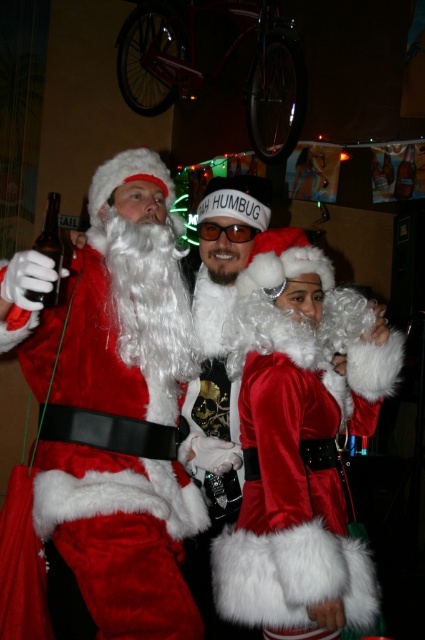
Question: Does velvet santa claus at left appear over velvet santa suit at center?

Choices:
 (A) no
 (B) yes

Answer: (B)

Question: Is velvet santa claus at left wider than velvet santa suit at center?

Choices:
 (A) no
 (B) yes

Answer: (B)

Question: Among these points, which one is farthest from the camera?

Choices:
 (A) (116, 202)
 (B) (206, 582)

Answer: (B)

Question: Can you confirm if velvet santa claus at left is positioned above brown glass bottle at left?

Choices:
 (A) yes
 (B) no

Answer: (B)

Question: Which object is closer to the camera taking this photo?

Choices:
 (A) velvet santa claus at left
 (B) velvet santa suit at center

Answer: (A)

Question: Which of these objects is positioned closest to the velvet santa claus at left?

Choices:
 (A) brown glass bottle at left
 (B) clear glass bottle at upper right
 (C) velvet santa suit at center

Answer: (A)